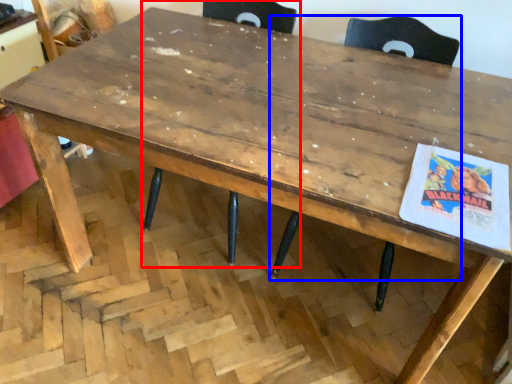
Question: Which object is closer to the camera taking this photo, chair (highlighted by a red box) or chair (highlighted by a blue box)?

Choices:
 (A) chair
 (B) chair

Answer: (B)